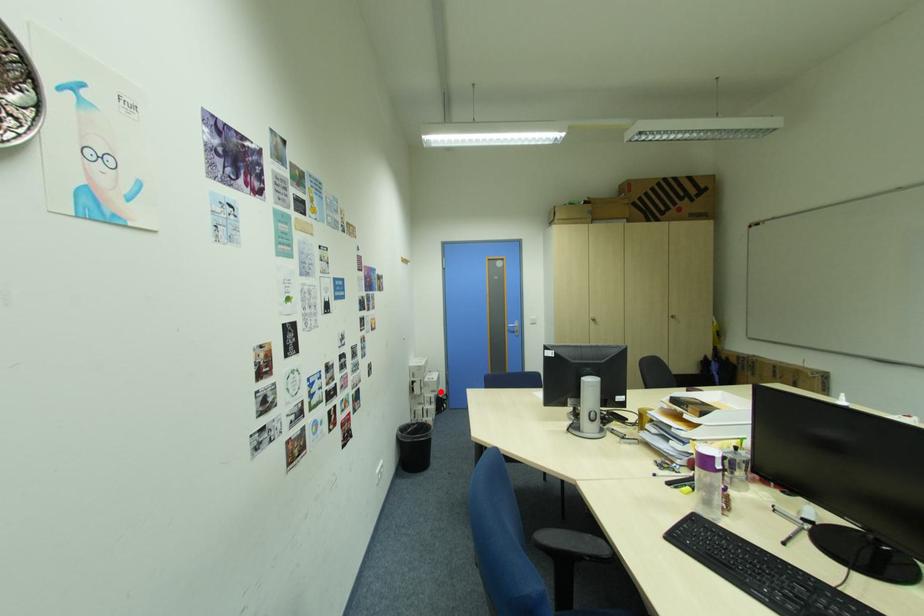
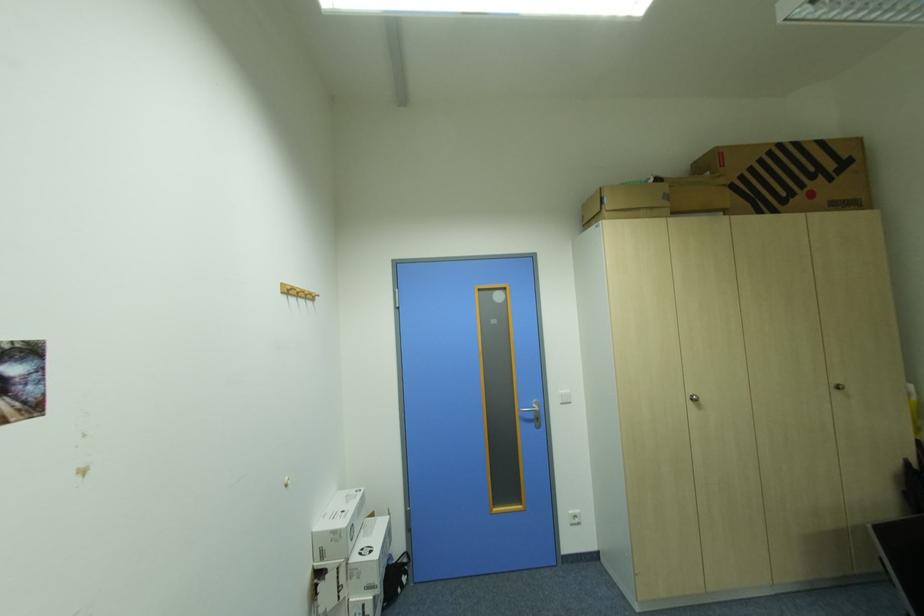
Question: I am providing you with two images of the same scene from different viewpoints. In image1, a red point is highlighted. Considering the same 3D point in image2, which of the following is correct?

Choices:
 (A) It is closer
 (B) It is farther

Answer: (A)